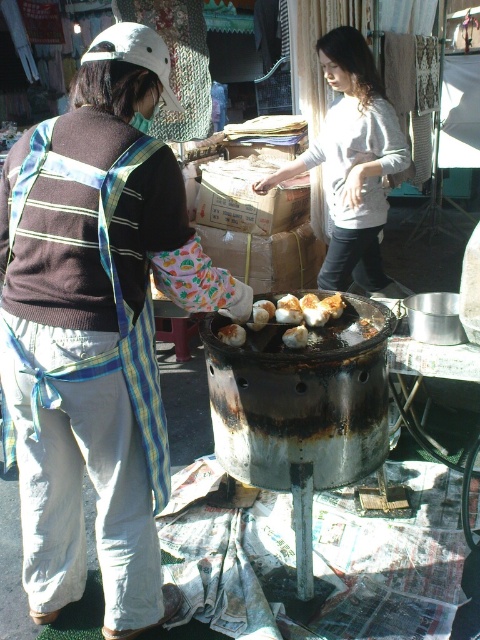
Question: Is brown matte egg at center above brown matte bread at center?

Choices:
 (A) yes
 (B) no

Answer: (B)

Question: Considering the real-world distances, which object is closest to the brown matte egg at center?

Choices:
 (A) brown matte dumplings at center
 (B) brown matte bread at center
 (C) light gray sweater at center
 (D) rusty metal grill at center

Answer: (B)

Question: Is rusty metal grill at center behind brown matte egg at center?

Choices:
 (A) yes
 (B) no

Answer: (B)

Question: Is rusty metal grill at center thinner than brown matte egg at center?

Choices:
 (A) no
 (B) yes

Answer: (A)

Question: Among these objects, which one is nearest to the camera?

Choices:
 (A) brown matte dumplings at center
 (B) brown matte bread at center

Answer: (A)

Question: Which object is closer to the camera taking this photo?

Choices:
 (A) rusty metal grill at center
 (B) brown matte bread at center
 (C) light gray sweater at center

Answer: (A)